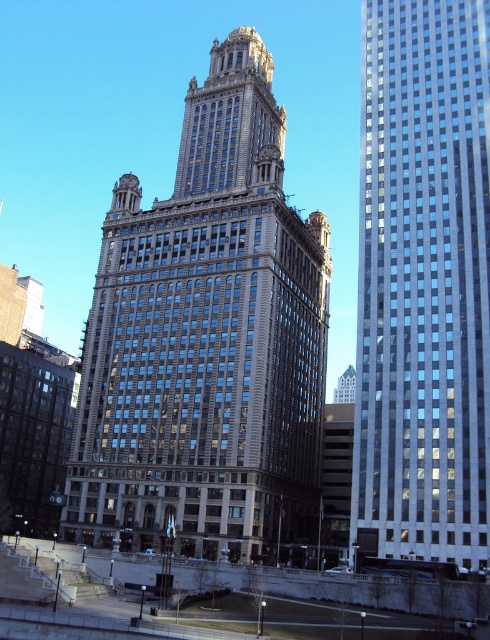
Consider the image. You are a photographer planning to capture both the brown stone building at center and the glassy reflective skyscraper at right in a single frame. Based on their positions, which building should you position closer to the left side of your camera viewfinder to include both structures without cropping either?

You should position the brown stone building at center closer to the left side of your camera viewfinder since it is already to the left of the glassy reflective skyscraper at right, allowing both to fit in the frame without cropping.

You are a photographer planning to take a photo of the brown stone building at center without the glassy reflective skyscraper at right appearing in the background. Is this possible given their spatial arrangement?

The glassy reflective skyscraper at right is behind the brown stone building at center, so it would be visible in the background. To avoid capturing it, you would need to adjust your position or use a different angle where the brown stone building at center blocks the view of the glassy reflective skyscraper at right.